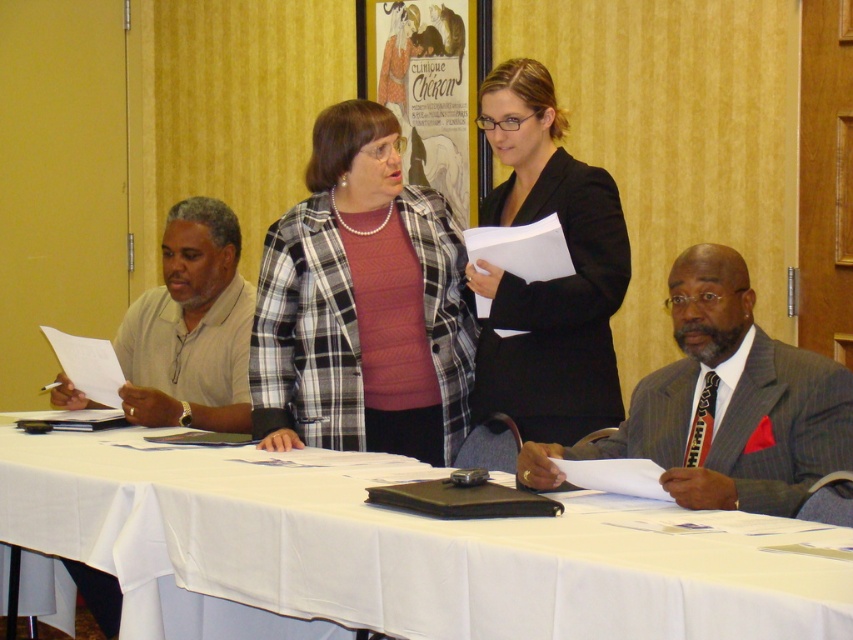
Is plaid fabric shirt at center to the left of light beige shirt at left from the viewer's perspective?

Incorrect, plaid fabric shirt at center is not on the left side of light beige shirt at left.

Is point (389, 285) positioned after point (177, 324)?

No.

The height and width of the screenshot is (640, 853). I want to click on plaid fabric shirt at center, so click(363, 305).

Between gray pinstripe suit at lower right and light beige shirt at left, which one appears on the left side from the viewer's perspective?

Positioned to the left is light beige shirt at left.

Who is more forward, (728, 492) or (160, 419)?

Point (728, 492) is more forward.

Between point (706, 349) and point (166, 292), which one is positioned in front?

Point (706, 349) is more forward.

What are the coordinates of `gray pinstripe suit at lower right` in the screenshot? It's located at (724, 403).

Does white cloth at center appear under gray pinstripe suit at lower right?

Correct, white cloth at center is located below gray pinstripe suit at lower right.

Locate an element on the screen. white cloth at center is located at coordinates (408, 547).